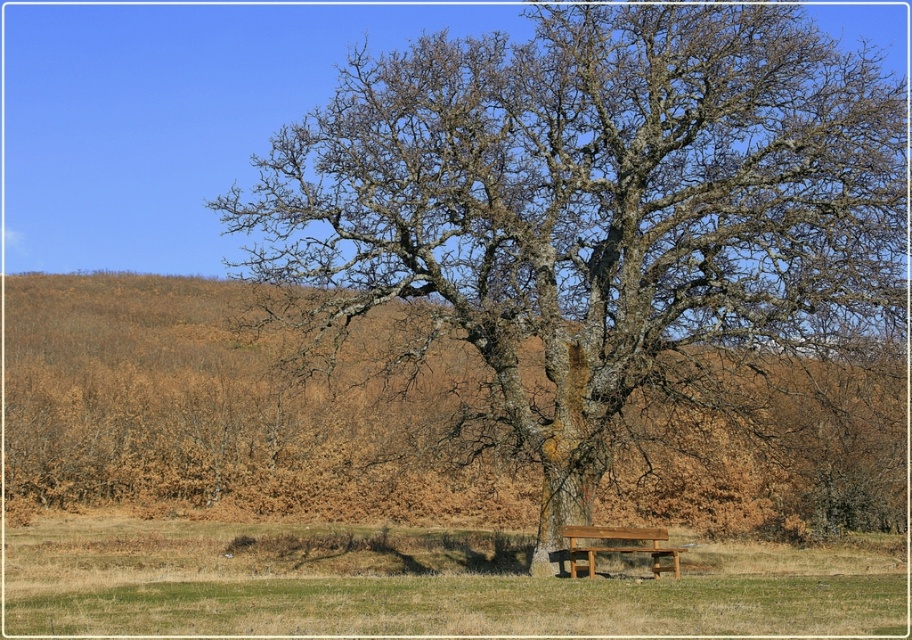
Does green grass at lower center appear on the right side of brown wooden bench at center?

Incorrect, green grass at lower center is not on the right side of brown wooden bench at center.

The width and height of the screenshot is (912, 640). What do you see at coordinates (426, 582) in the screenshot? I see `green grass at lower center` at bounding box center [426, 582].

Where is `green grass at lower center`? This screenshot has height=640, width=912. green grass at lower center is located at coordinates (426, 582).

Is the position of smooth bark tree at center more distant than that of green grass at lower center?

Yes, smooth bark tree at center is further from the viewer.

Looking at this image, is smooth bark tree at center smaller than green grass at lower center?

Incorrect, smooth bark tree at center is not smaller in size than green grass at lower center.

You are a GUI agent. You are given a task and a screenshot of the screen. Output one action in this format:
    pyautogui.click(x=<x>, y=<y>)
    Task: Click on the smooth bark tree at center
    
    Given the screenshot: What is the action you would take?
    pyautogui.click(x=596, y=205)

Looking at this image, between smooth bark tree at center and brown dry grass at center, which one has more height?

With more height is smooth bark tree at center.

Based on the photo, is smooth bark tree at center wider than brown dry grass at center?

Incorrect, smooth bark tree at center's width does not surpass brown dry grass at center's.

Measure the distance between smooth bark tree at center and camera.

The distance of smooth bark tree at center from camera is 25.02 meters.

Image resolution: width=912 pixels, height=640 pixels. Find the location of `smooth bark tree at center`. smooth bark tree at center is located at coordinates (596, 205).